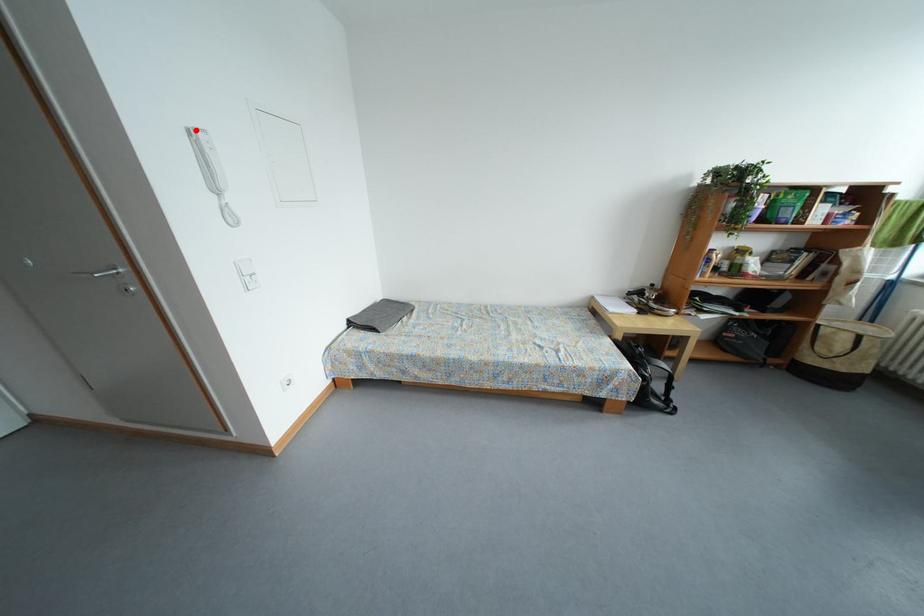
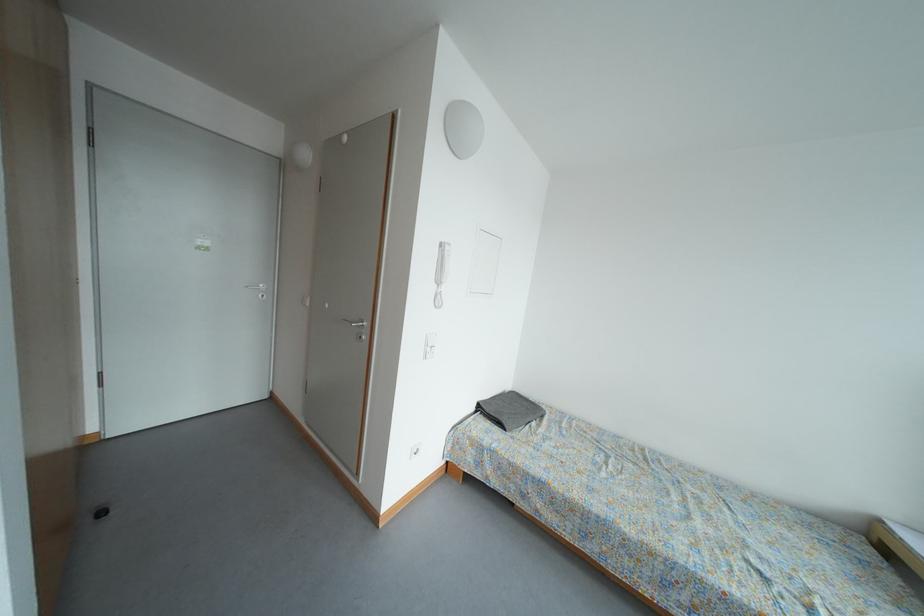
Where in the second image is the point corresponding to the highlighted location from the first image?

(450, 246)